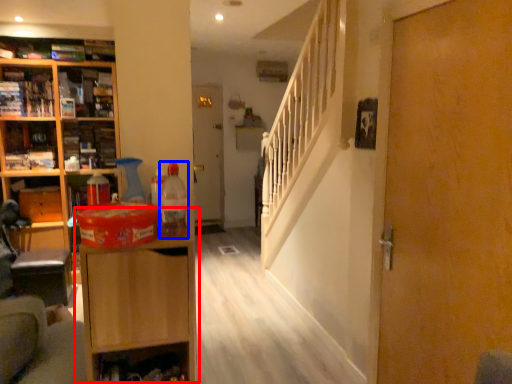
Question: Which object appears farthest to the camera in this image, cabinetry (highlighted by a red box) or bottle (highlighted by a blue box)?

Choices:
 (A) cabinetry
 (B) bottle

Answer: (B)